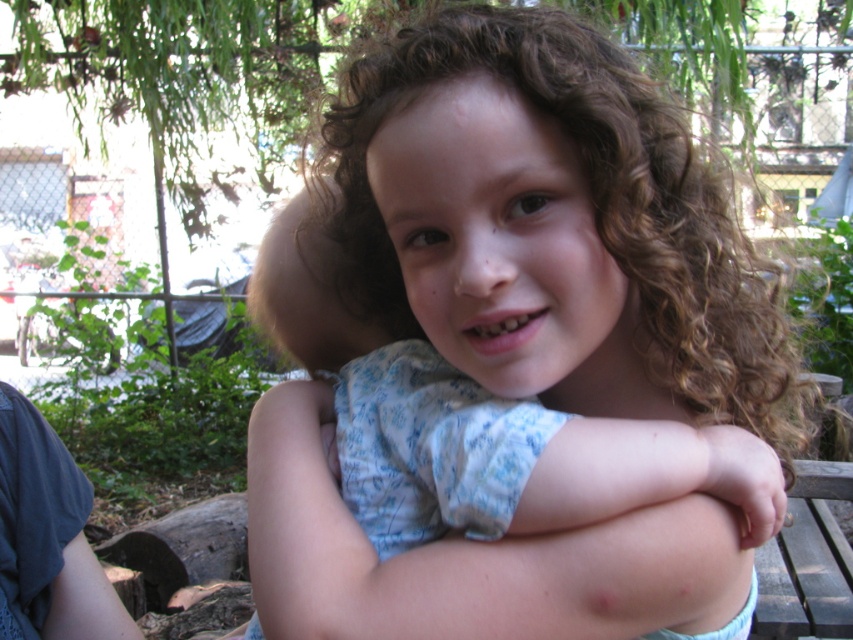
Question: Considering the real-world distances, which object is farthest from the curly brown hair at center?

Choices:
 (A) light blue fabric shirt at center
 (B) pale skin at center

Answer: (B)

Question: Observing the image, what is the correct spatial positioning of curly brown hair at center in reference to light blue fabric shirt at center?

Choices:
 (A) left
 (B) right

Answer: (B)

Question: Can you confirm if curly brown hair at center is wider than pale skin at center?

Choices:
 (A) yes
 (B) no

Answer: (A)

Question: Does curly brown hair at center appear under light blue fabric shirt at center?

Choices:
 (A) no
 (B) yes

Answer: (A)

Question: Which object is closer to the camera taking this photo?

Choices:
 (A) light blue fabric shirt at center
 (B) pale skin at center
 (C) curly brown hair at center

Answer: (C)

Question: Among these points, which one is farthest from the camera?

Choices:
 (A) (318, 496)
 (B) (637, 259)

Answer: (A)